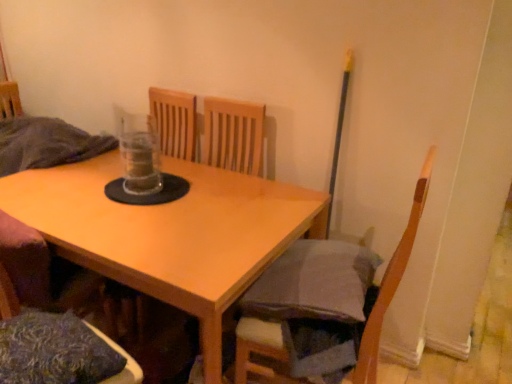
Question: Considering the relative sizes of wooden chair at lower left, the 1th chair from the left, and wooden chair at lower right, marked as the 1th chair in a right-to-left arrangement, in the image provided, is wooden chair at lower left, the 1th chair from the left, bigger than wooden chair at lower right, marked as the 1th chair in a right-to-left arrangement,?

Choices:
 (A) yes
 (B) no

Answer: (B)

Question: Is wooden chair at lower left, the 1th chair from the left, outside of wooden chair at lower right, marked as the 1th chair in a right-to-left arrangement?

Choices:
 (A) yes
 (B) no

Answer: (A)

Question: Could you tell me if wooden chair at lower left, acting as the 2th chair starting from the right, is turned towards wooden chair at lower right, marked as the 1th chair in a right-to-left arrangement?

Choices:
 (A) yes
 (B) no

Answer: (B)

Question: Is wooden chair at lower left, the 1th chair from the left, at the right side of wooden chair at lower right, marked as the 1th chair in a right-to-left arrangement?

Choices:
 (A) no
 (B) yes

Answer: (A)

Question: Is wooden chair at lower left, acting as the 2th chair starting from the right, shorter than wooden chair at lower right, marked as the 1th chair in a right-to-left arrangement?

Choices:
 (A) yes
 (B) no

Answer: (A)

Question: Is textured blue pillow at lower left spatially inside wooden chair at lower left, the 1th chair from the left, or outside of it?

Choices:
 (A) inside
 (B) outside

Answer: (A)

Question: In terms of height, does textured blue pillow at lower left look taller or shorter compared to wooden chair at lower left, acting as the 2th chair starting from the right?

Choices:
 (A) tall
 (B) short

Answer: (B)

Question: Is textured blue pillow at lower left wider or thinner than wooden chair at lower left, the 1th chair from the left?

Choices:
 (A) wide
 (B) thin

Answer: (A)

Question: From a real-world perspective, relative to wooden chair at lower left, acting as the 2th chair starting from the right, is textured blue pillow at lower left vertically above or below?

Choices:
 (A) above
 (B) below

Answer: (B)

Question: Considering the positions of point (210, 374) and point (40, 377), is point (210, 374) closer or farther from the camera than point (40, 377)?

Choices:
 (A) farther
 (B) closer

Answer: (A)

Question: Is light wood table at center inside or outside of textured blue pillow at lower left?

Choices:
 (A) inside
 (B) outside

Answer: (B)

Question: Considering their positions, is light wood table at center located in front of or behind textured blue pillow at lower left?

Choices:
 (A) behind
 (B) front

Answer: (A)

Question: From a real-world perspective, relative to textured blue pillow at lower left, is light wood table at center vertically above or below?

Choices:
 (A) below
 (B) above

Answer: (A)

Question: Based on their sizes in the image, would you say textured blue pillow at lower left is bigger or smaller than wooden chair at lower right, marked as the 1th chair in a right-to-left arrangement?

Choices:
 (A) small
 (B) big

Answer: (A)

Question: Is textured blue pillow at lower left wider or thinner than wooden chair at lower right, which ranks as the 2th chair in left-to-right order?

Choices:
 (A) wide
 (B) thin

Answer: (B)